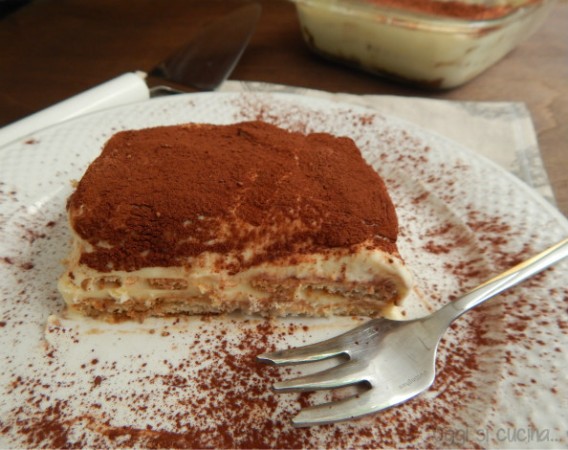
Identify the location of fork. (402, 357).